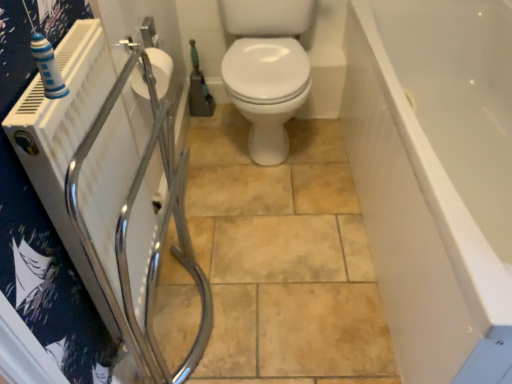
Question: From the image's perspective, would you say green rubber garden hose at center is positioned over white glossy bathtub at right?

Choices:
 (A) yes
 (B) no

Answer: (A)

Question: Is green rubber garden hose at center oriented away from white glossy bathtub at right?

Choices:
 (A) no
 (B) yes

Answer: (A)

Question: Is green rubber garden hose at center further to camera compared to white glossy bathtub at right?

Choices:
 (A) no
 (B) yes

Answer: (B)

Question: Are green rubber garden hose at center and white glossy bathtub at right making contact?

Choices:
 (A) yes
 (B) no

Answer: (B)

Question: Are green rubber garden hose at center and white glossy bathtub at right far apart?

Choices:
 (A) yes
 (B) no

Answer: (A)

Question: Is point (498, 54) positioned closer to the camera than point (211, 109)?

Choices:
 (A) closer
 (B) farther

Answer: (A)

Question: In terms of width, does white glossy bathtub at right look wider or thinner when compared to green rubber garden hose at center?

Choices:
 (A) thin
 (B) wide

Answer: (B)

Question: Relative to green rubber garden hose at center, is white glossy bathtub at right in front or behind?

Choices:
 (A) behind
 (B) front

Answer: (B)

Question: Is white glossy bathtub at right bigger or smaller than green rubber garden hose at center?

Choices:
 (A) big
 (B) small

Answer: (A)

Question: Is green rubber garden hose at center taller or shorter than white glossy bathtub at right?

Choices:
 (A) short
 (B) tall

Answer: (A)

Question: Considering the positions of point (196, 79) and point (488, 44), is point (196, 79) closer or farther from the camera than point (488, 44)?

Choices:
 (A) farther
 (B) closer

Answer: (A)

Question: Is green rubber garden hose at center inside or outside of white glossy bathtub at right?

Choices:
 (A) inside
 (B) outside

Answer: (B)

Question: From a real-world perspective, relative to white glossy bathtub at right, is green rubber garden hose at center vertically above or below?

Choices:
 (A) below
 (B) above

Answer: (A)

Question: In the image, is white glossy bathtub at right on the left side or the right side of white matte toilet paper at upper left?

Choices:
 (A) right
 (B) left

Answer: (A)

Question: In terms of height, does white glossy bathtub at right look taller or shorter compared to white matte toilet paper at upper left?

Choices:
 (A) short
 (B) tall

Answer: (B)